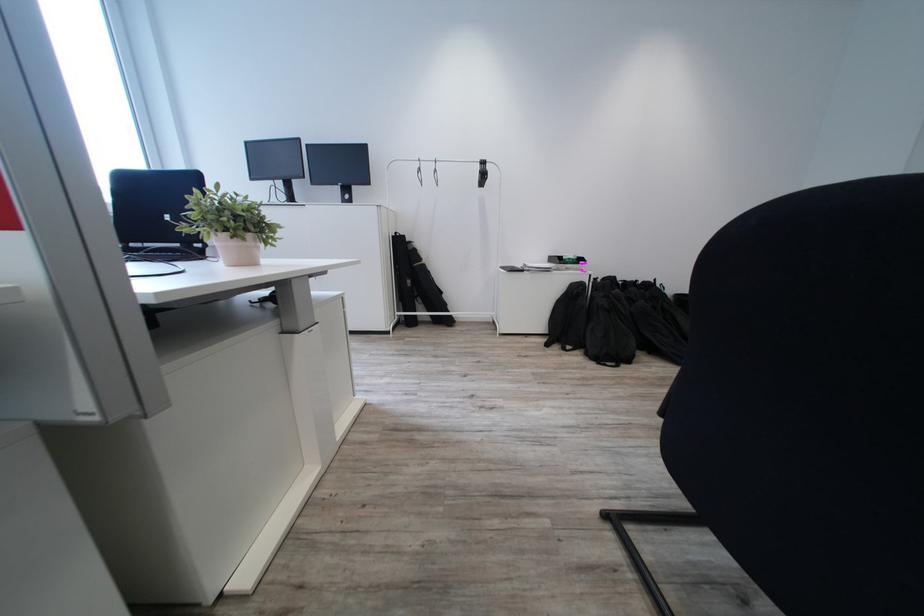
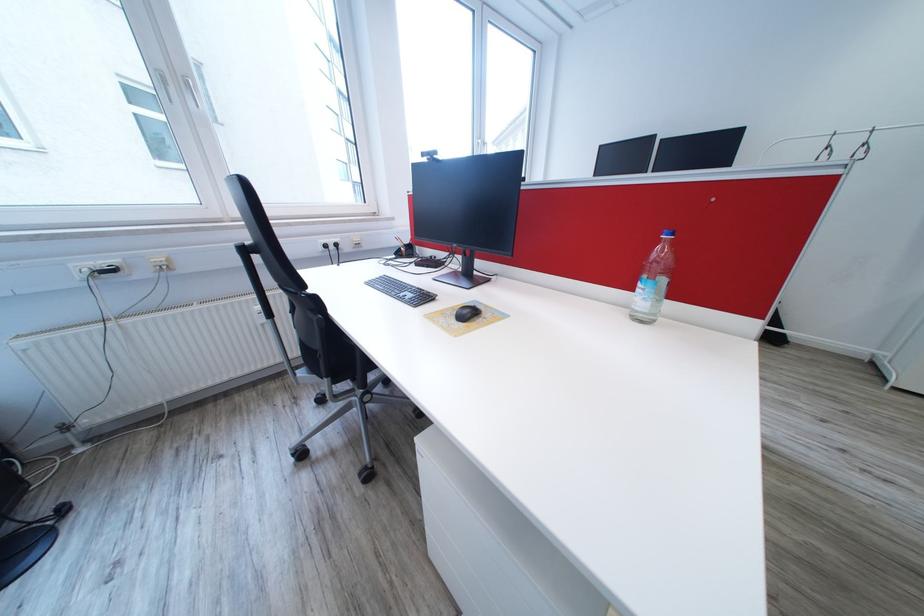
Question: The first image is from the beginning of the video and the second image is from the end. How did the camera likely rotate when shooting the video?

Choices:
 (A) Left
 (B) Right
 (C) Up
 (D) Down

Answer: (A)